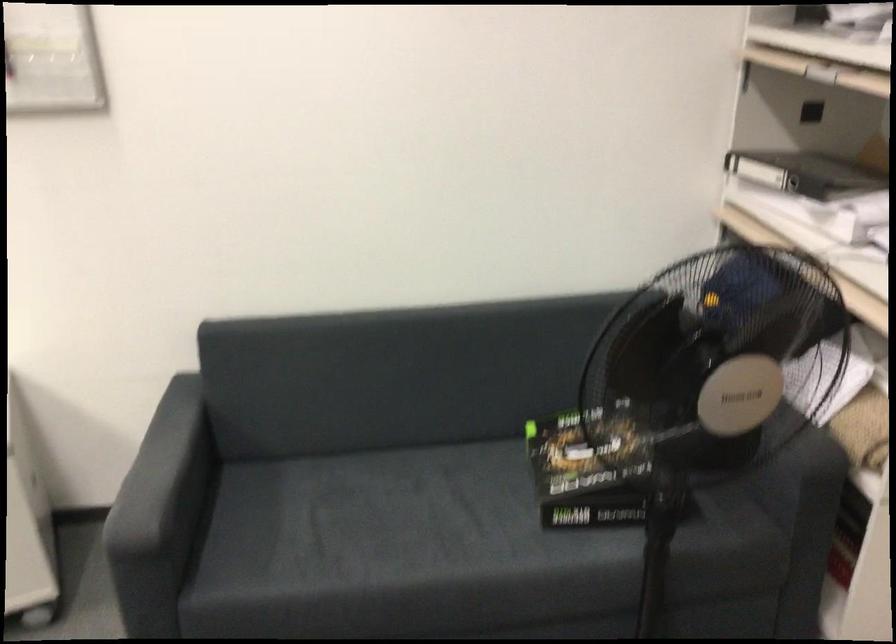
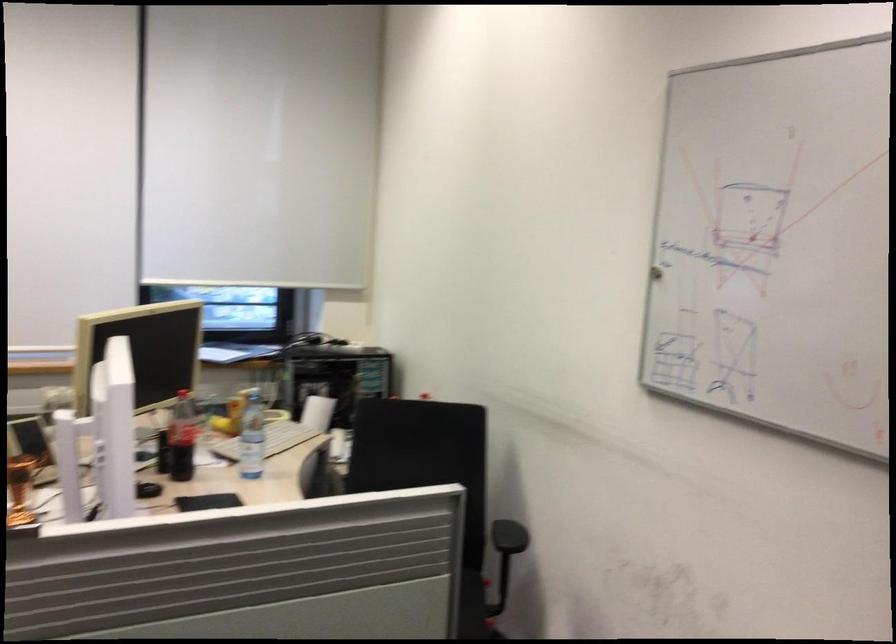
Question: The camera is either moving clockwise (left) or counter-clockwise (right) around the object. The first image is from the beginning of the video and the second image is from the end. Is the camera moving left or right when shooting the video?

Choices:
 (A) Left
 (B) Right

Answer: (B)